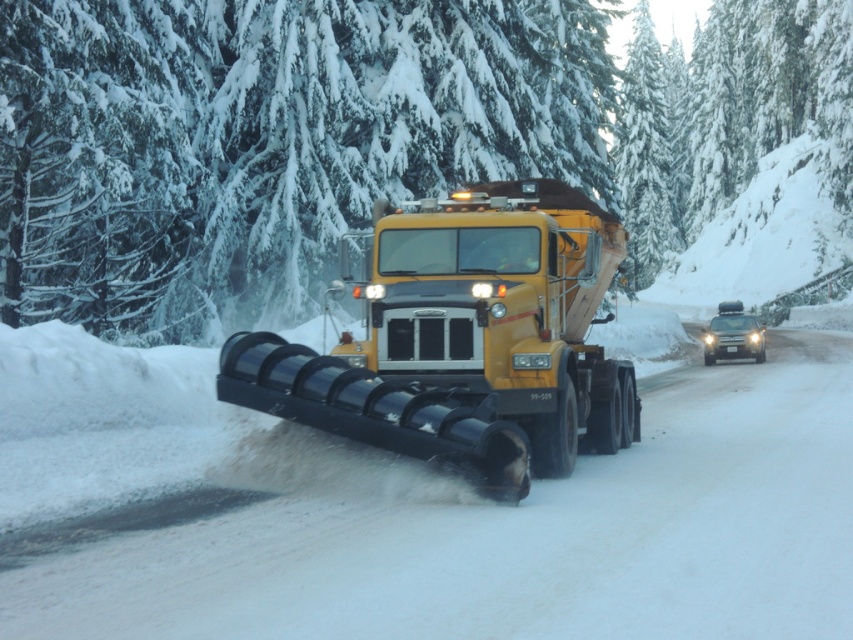
Consider the image. Can you confirm if green snow-covered trees at upper center is smaller than matte silver suv at right?

Actually, green snow-covered trees at upper center might be larger than matte silver suv at right.

Is green snow-covered trees at upper center to the left of matte silver suv at right from the viewer's perspective?

Incorrect, green snow-covered trees at upper center is not on the left side of matte silver suv at right.

Where is `green snow-covered trees at upper center`? The image size is (853, 640). green snow-covered trees at upper center is located at coordinates (367, 132).

Is green snow-covered trees at upper center positioned before yellow matte/solid truck at center?

No.

Is point (74, 136) farther from camera compared to point (482, 444)?

Yes, it is behind point (482, 444).

Who is more forward, (175, 284) or (523, 396)?

Positioned in front is point (523, 396).

Image resolution: width=853 pixels, height=640 pixels. What are the coordinates of `green snow-covered trees at upper center` in the screenshot? It's located at (367, 132).

Which is below, yellow matte/solid truck at center or matte silver suv at right?

yellow matte/solid truck at center is lower down.

Is point (476, 285) farther from camera compared to point (733, 326)?

No, it is in front of (733, 326).

At what (x,y) coordinates should I click in order to perform the action: click on yellow matte/solid truck at center. Please return your answer as a coordinate pair (x, y). The width and height of the screenshot is (853, 640). Looking at the image, I should click on (463, 339).